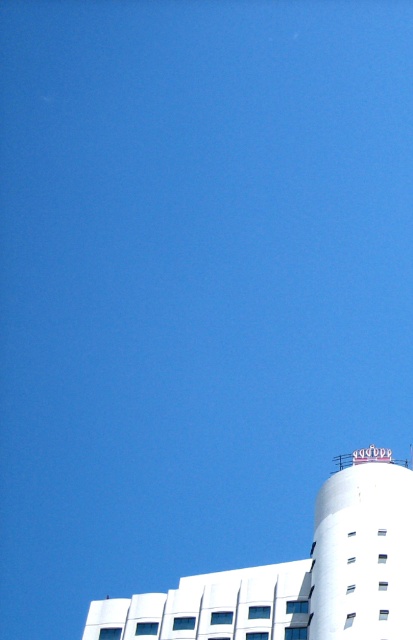
Does white smooth building at lower right come behind white smooth water tower at bottom right?

That is True.

Who is more forward, (391, 470) or (398, 605)?

Point (398, 605) is in front.

At what (x,y) coordinates should I click in order to perform the action: click on white smooth building at lower right. Please return your answer as a coordinate pair (x, y). Image resolution: width=413 pixels, height=640 pixels. Looking at the image, I should click on tap(299, 573).